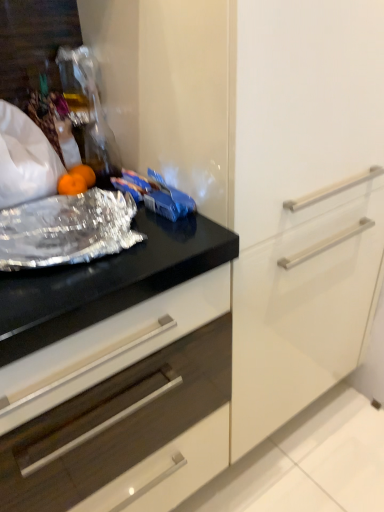
Question: Would you say shiny metallic foil at left contains black glossy countertop at center?

Choices:
 (A) yes
 (B) no

Answer: (B)

Question: Can you confirm if shiny metallic foil at left is positioned to the left of black glossy countertop at center?

Choices:
 (A) no
 (B) yes

Answer: (A)

Question: From a real-world perspective, is shiny metallic foil at left positioned over black glossy countertop at center based on gravity?

Choices:
 (A) yes
 (B) no

Answer: (A)

Question: From the image's perspective, does shiny metallic foil at left appear lower than black glossy countertop at center?

Choices:
 (A) no
 (B) yes

Answer: (A)

Question: From the image's perspective, is shiny metallic foil at left on top of black glossy countertop at center?

Choices:
 (A) yes
 (B) no

Answer: (A)

Question: Considering the relative sizes of shiny metallic foil at left and black glossy countertop at center in the image provided, is shiny metallic foil at left wider than black glossy countertop at center?

Choices:
 (A) yes
 (B) no

Answer: (B)

Question: From a real-world perspective, is black glossy countertop at center physically below shiny metallic foil at left?

Choices:
 (A) no
 (B) yes

Answer: (B)

Question: Is black glossy countertop at center to the left of shiny metallic foil at left from the viewer's perspective?

Choices:
 (A) yes
 (B) no

Answer: (A)

Question: From a real-world perspective, is black glossy countertop at center physically above shiny metallic foil at left?

Choices:
 (A) no
 (B) yes

Answer: (A)

Question: Is black glossy countertop at center at the right side of shiny metallic foil at left?

Choices:
 (A) yes
 (B) no

Answer: (B)

Question: Is black glossy countertop at center thinner than shiny metallic foil at left?

Choices:
 (A) no
 (B) yes

Answer: (A)

Question: Does black glossy countertop at center come behind shiny metallic foil at left?

Choices:
 (A) yes
 (B) no

Answer: (B)

Question: Is shiny metallic foil at left in front of or behind black glossy countertop at center in the image?

Choices:
 (A) behind
 (B) front

Answer: (A)